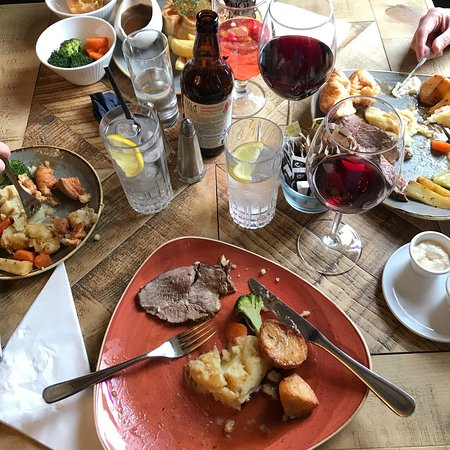
Where is `fork`? fork is located at coordinates (176, 345).